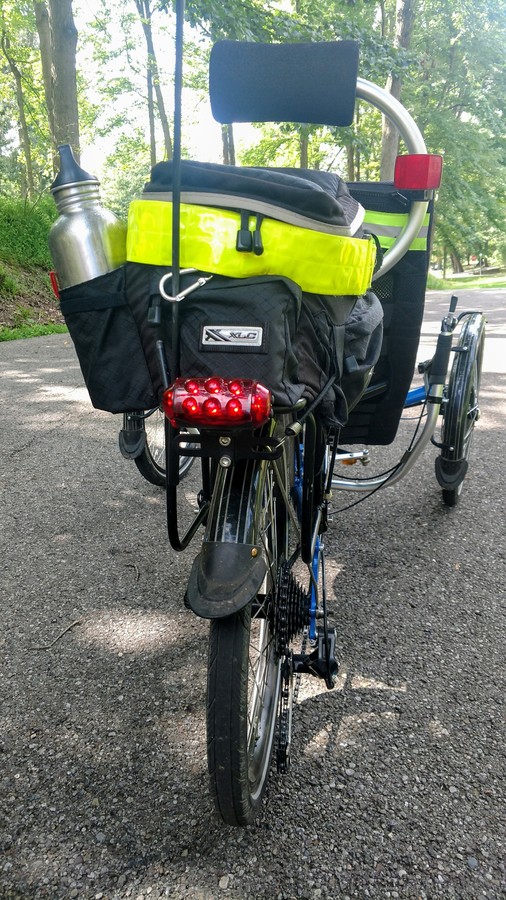
Identify the location of pillow. (331, 69).